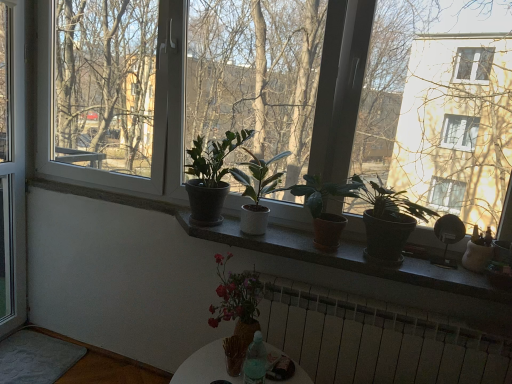
Question: From a real-world perspective, is brown terracotta pot at center, positioned as the 4th houseplant in left-to-right order, physically located above or below matte black pot at center, the 1th houseplant viewed from the right?

Choices:
 (A) below
 (B) above

Answer: (A)

Question: Visually, is brown terracotta pot at center, positioned as the 4th houseplant in left-to-right order, positioned to the left or to the right of matte black pot at center, which ranks as the 5th houseplant in left-to-right order?

Choices:
 (A) right
 (B) left

Answer: (B)

Question: Which is nearer to the matte black pot at center, the 1th houseplant viewed from the right?

Choices:
 (A) pink matte vase at center, the 2th houseplant when ordered from left to right
 (B) matte white pot at center, the 3th houseplant from the left
 (C) matte concrete window sill at center
 (D) translucent glass vase at lower center
 (E) soft gray carpet at lower left

Answer: (C)

Question: Considering the real-world distances, which object is farthest from the matte black pot at center, the 1th houseplant viewed from the right?

Choices:
 (A) matte black pot at center, which ranks as the fifth houseplant in right-to-left order
 (B) matte white pot at center, the 3th houseplant from the left
 (C) white metallic radiator at lower center
 (D) transparent glass window at left
 (E) soft gray carpet at lower left

Answer: (D)